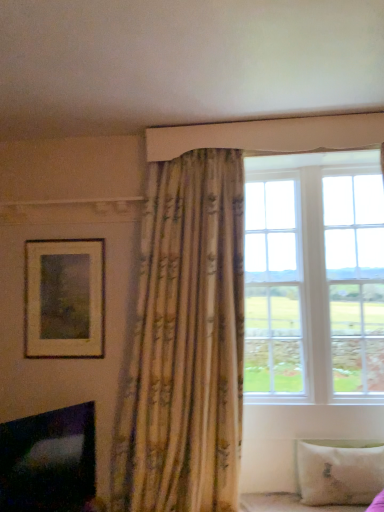
Question: Is white fabric bed frame at lower right at the right side of black glossy fireplace at lower left?

Choices:
 (A) yes
 (B) no

Answer: (A)

Question: Considering the relative positions of white fabric bed frame at lower right and black glossy fireplace at lower left in the image provided, is white fabric bed frame at lower right in front of black glossy fireplace at lower left?

Choices:
 (A) yes
 (B) no

Answer: (B)

Question: Considering the relative sizes of white fabric bed frame at lower right and black glossy fireplace at lower left in the image provided, is white fabric bed frame at lower right shorter than black glossy fireplace at lower left?

Choices:
 (A) no
 (B) yes

Answer: (B)

Question: Does white fabric bed frame at lower right come behind black glossy fireplace at lower left?

Choices:
 (A) yes
 (B) no

Answer: (A)

Question: Can black glossy fireplace at lower left be found inside white fabric bed frame at lower right?

Choices:
 (A) yes
 (B) no

Answer: (B)

Question: Considering the positions of point (249, 282) and point (69, 308), is point (249, 282) closer or farther from the camera than point (69, 308)?

Choices:
 (A) closer
 (B) farther

Answer: (B)

Question: Considering the positions of white wood window at upper right and matte gold picture frame at upper left in the image, is white wood window at upper right wider or thinner than matte gold picture frame at upper left?

Choices:
 (A) thin
 (B) wide

Answer: (B)

Question: Is white wood window at upper right inside or outside of matte gold picture frame at upper left?

Choices:
 (A) outside
 (B) inside

Answer: (A)

Question: From the image's perspective, is white wood window at upper right located above or below matte gold picture frame at upper left?

Choices:
 (A) above
 (B) below

Answer: (A)

Question: From the image's perspective, relative to white soft pillow at lower right, is matte gold picture frame at upper left above or below?

Choices:
 (A) below
 (B) above

Answer: (B)

Question: Considering the positions of point (29, 334) and point (365, 459), is point (29, 334) closer or farther from the camera than point (365, 459)?

Choices:
 (A) farther
 (B) closer

Answer: (A)

Question: In terms of width, does matte gold picture frame at upper left look wider or thinner when compared to white soft pillow at lower right?

Choices:
 (A) wide
 (B) thin

Answer: (B)

Question: Would you say matte gold picture frame at upper left is to the left or to the right of white soft pillow at lower right in the picture?

Choices:
 (A) left
 (B) right

Answer: (A)

Question: Is white wood window at upper right bigger or smaller than white fabric bed frame at lower right?

Choices:
 (A) small
 (B) big

Answer: (B)

Question: In terms of width, does white wood window at upper right look wider or thinner when compared to white fabric bed frame at lower right?

Choices:
 (A) wide
 (B) thin

Answer: (A)